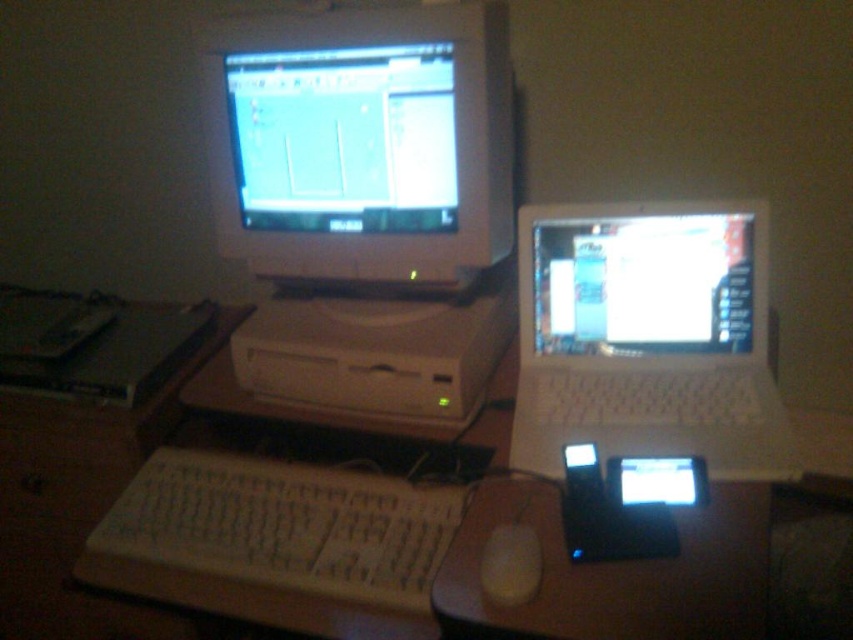
You are setting up a new monitor stand that requires the monitor to be at least 20 cm taller than the keyboard. Based on the scene, can the white glossy monitor at upper center and the white plastic keyboard at center be placed on this stand?

The white glossy monitor at upper center is much taller than the white plastic keyboard at center, so it meets the requirement of being at least 20 cm taller. Therefore, they can be placed on the monitor stand.

You are setting up a new monitor in the workspace shown. The monitor must be placed exactly at the point specified in the image. Which object is located at point (328, 596)?

The white plastic computer desk at center is located at point (328, 596).

You are organizing your desk and want to place the white plastic mouse at center next to the white plastic laptop at right. Since the mouse is smaller, will it fit comfortably next to the laptop without overcrowding the space?

The white plastic laptop at right has a larger size compared to the white plastic mouse at center, so the mouse will fit comfortably next to the laptop without overcrowding the space.